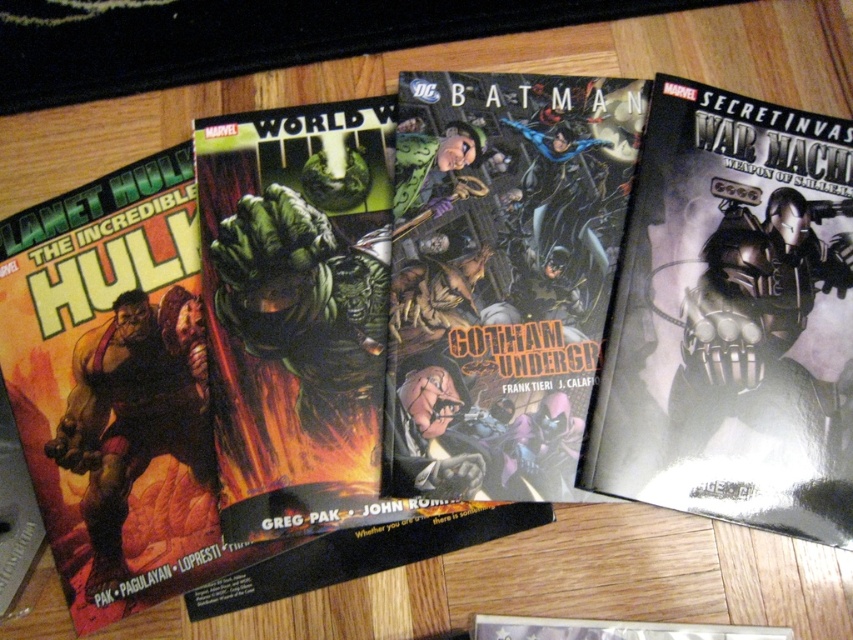
Can you confirm if metallic silver robot at right is positioned above rubberized green hulk at left?

Yes.

Is metallic silver robot at right further to camera compared to rubberized green hulk at left?

No, it is in front of rubberized green hulk at left.

Is point (645, 305) farther from camera compared to point (54, 442)?

No, it is not.

Locate an element on the screen. This screenshot has width=853, height=640. metallic silver robot at right is located at coordinates (730, 320).